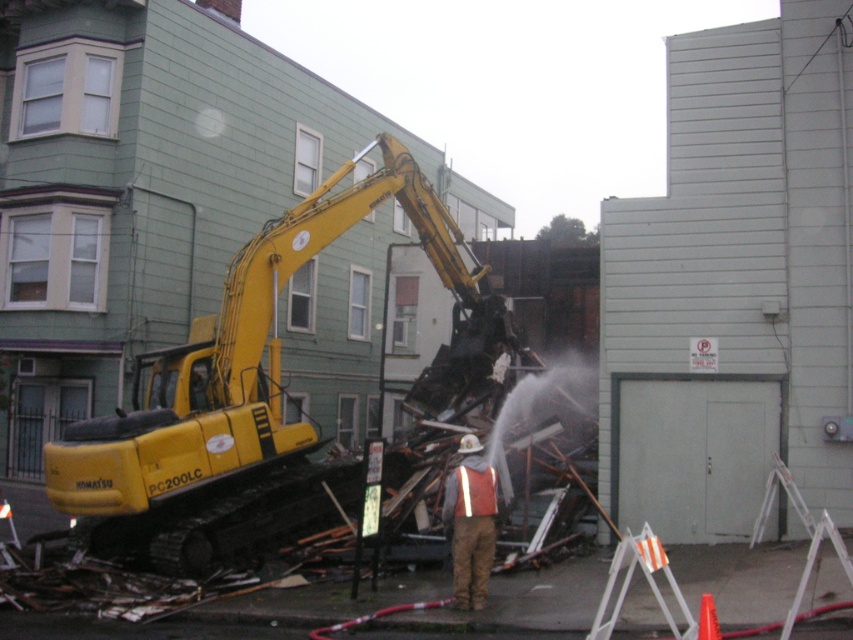
You are a safety inspector at the construction site. You need to locate the yellow tracked excavator at left to ensure it is operating within the designated safety zone. According to the coordinates provided, is the excavator positioned correctly?

The yellow tracked excavator at left is positioned at coordinates point (244, 388), so it is operating within the designated safety zone.

You are a safety inspector at the construction site. You need to ensure that all workers are at least 10 meters away from the yellow tracked excavator at left for safety. Is the worker in the orange vest currently within the safe distance?

The yellow tracked excavator at left is 11.21 meters away from camera. Since the worker is near the debris in the center, which is between the excavator and the camera, the worker is likely closer than 11.21 meters. Therefore, the worker may be within the unsafe distance and needs to move further back.